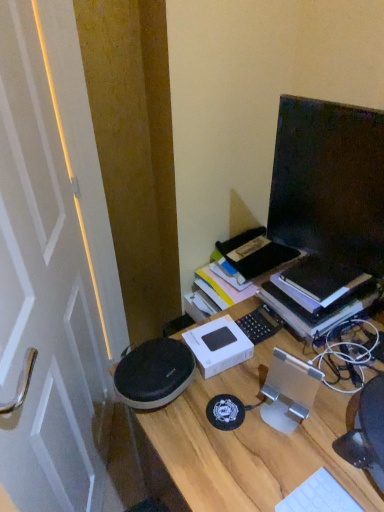
Question: Considering the relative sizes of hardcover book at right and black glossy monitor at upper right in the image provided, is hardcover book at right taller than black glossy monitor at upper right?

Choices:
 (A) no
 (B) yes

Answer: (A)

Question: Can you confirm if hardcover book at right is smaller than black glossy monitor at upper right?

Choices:
 (A) yes
 (B) no

Answer: (B)

Question: Considering the relative positions of hardcover book at right and black glossy monitor at upper right in the image provided, is hardcover book at right to the right of black glossy monitor at upper right from the viewer's perspective?

Choices:
 (A) no
 (B) yes

Answer: (B)

Question: From a real-world perspective, is hardcover book at right beneath black glossy monitor at upper right?

Choices:
 (A) no
 (B) yes

Answer: (B)

Question: Is black glossy monitor at upper right located within hardcover book at right?

Choices:
 (A) no
 (B) yes

Answer: (A)

Question: Is point (243, 428) closer or farther from the camera than point (345, 317)?

Choices:
 (A) closer
 (B) farther

Answer: (A)

Question: Based on their positions, is wooden desk at center located to the left or right of hardcover book at right?

Choices:
 (A) right
 (B) left

Answer: (B)

Question: In terms of width, does wooden desk at center look wider or thinner when compared to hardcover book at right?

Choices:
 (A) thin
 (B) wide

Answer: (B)

Question: Is wooden desk at center bigger or smaller than hardcover book at right?

Choices:
 (A) small
 (B) big

Answer: (B)

Question: In the image, is white plastic keyboard at lower right positioned in front of or behind white glossy door at left?

Choices:
 (A) front
 (B) behind

Answer: (B)

Question: Considering the positions of white plastic keyboard at lower right and white glossy door at left in the image, is white plastic keyboard at lower right taller or shorter than white glossy door at left?

Choices:
 (A) short
 (B) tall

Answer: (A)

Question: In terms of size, does white plastic keyboard at lower right appear bigger or smaller than white glossy door at left?

Choices:
 (A) small
 (B) big

Answer: (A)

Question: In terms of width, does white plastic keyboard at lower right look wider or thinner when compared to white glossy door at left?

Choices:
 (A) thin
 (B) wide

Answer: (B)

Question: From a real-world perspective, is white glossy door at left above or below wooden desk at center?

Choices:
 (A) below
 (B) above

Answer: (B)

Question: Is white glossy door at left to the left or to the right of wooden desk at center in the image?

Choices:
 (A) left
 (B) right

Answer: (A)